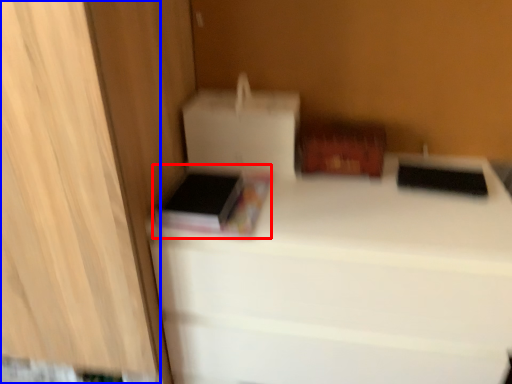
Question: Which of the following is the farthest to the observer, book (highlighted by a red box) or cabinetry (highlighted by a blue box)?

Choices:
 (A) book
 (B) cabinetry

Answer: (A)